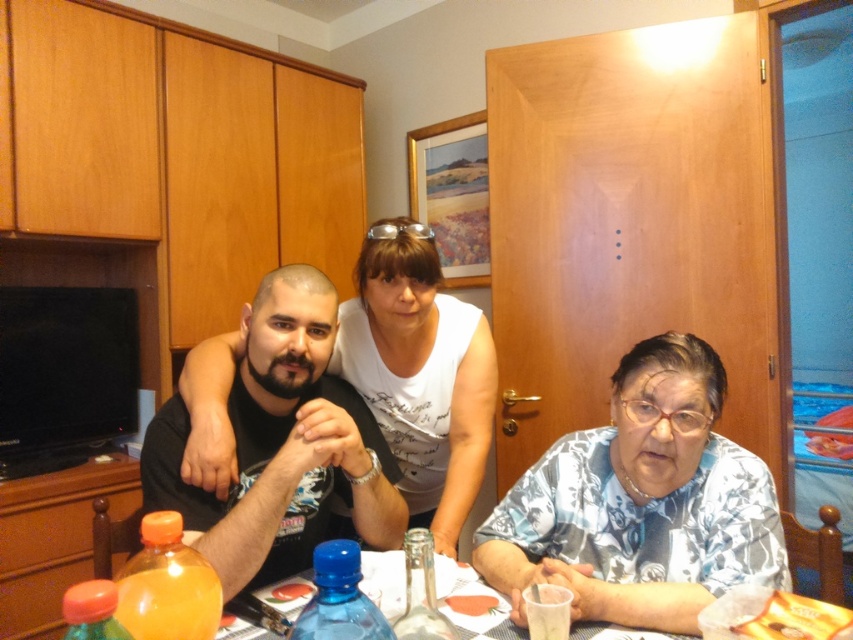
Question: Which object is closer to the camera taking this photo?

Choices:
 (A) silver metallic glasses at upper center
 (B) translucent plastic table at center
 (C) translucent plastic cup at lower center
 (D) smooth salmon fillet at center

Answer: (B)

Question: Can you confirm if translucent orange bottle at lower left is positioned to the right of smooth salmon fillet at center?

Choices:
 (A) yes
 (B) no

Answer: (B)

Question: Which object is closer to the camera taking this photo?

Choices:
 (A) floral-patterned fabric at lower right
 (B) orange matte bottle at lower left
 (C) smooth salmon fillet at center

Answer: (B)

Question: Which point is closer to the camera taking this photo?

Choices:
 (A) (310, 451)
 (B) (752, 522)
 (C) (424, 536)

Answer: (C)

Question: Can you confirm if translucent plastic table at center is wider than translucent orange bottle at lower left?

Choices:
 (A) yes
 (B) no

Answer: (A)

Question: Does silver metallic glasses at upper center appear under smooth salmon fillet at center?

Choices:
 (A) no
 (B) yes

Answer: (A)